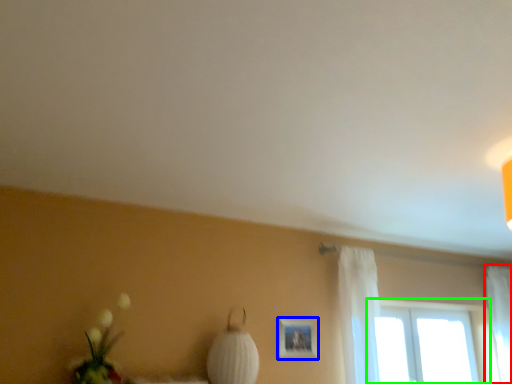
Question: Which object is the closest to the curtain (highlighted by a red box)? Choose among these: picture frame (highlighted by a blue box) or window (highlighted by a green box).

Choices:
 (A) picture frame
 (B) window

Answer: (B)